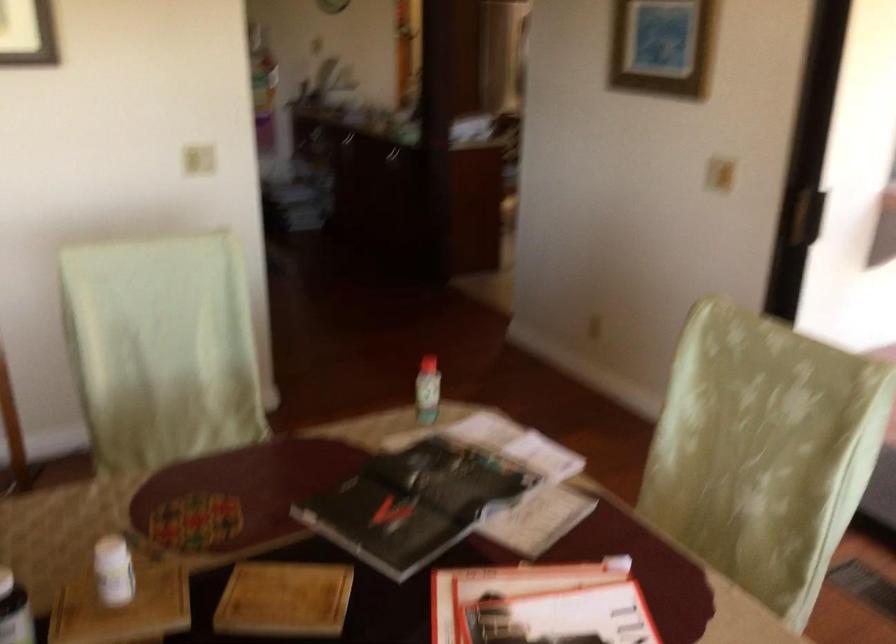
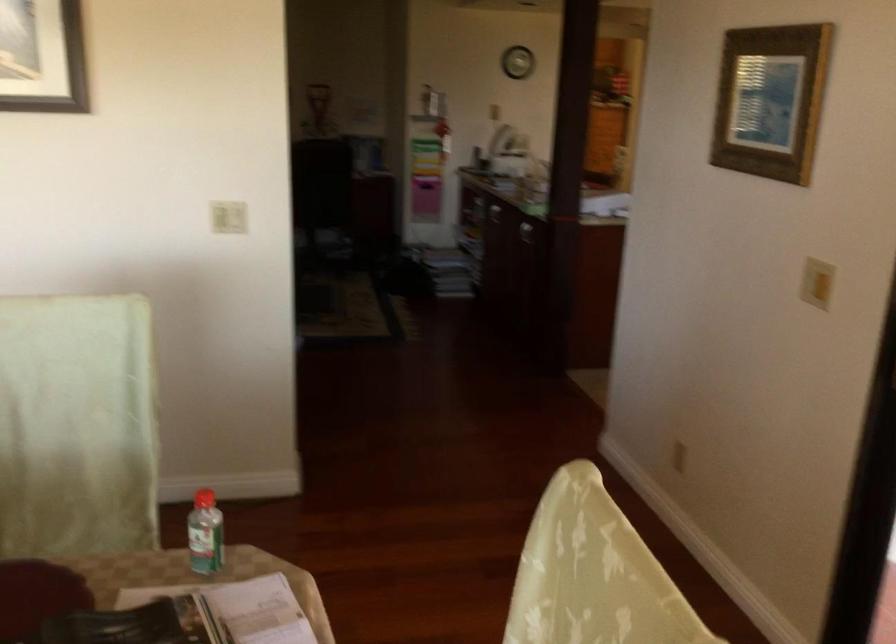
Find the pixel in the second image that matches (719,162) in the first image.

(816, 283)